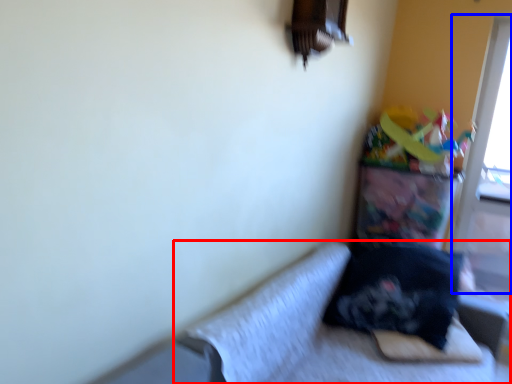
Question: Which object is closer to the camera taking this photo, studio couch (highlighted by a red box) or screen door (highlighted by a blue box)?

Choices:
 (A) studio couch
 (B) screen door

Answer: (A)